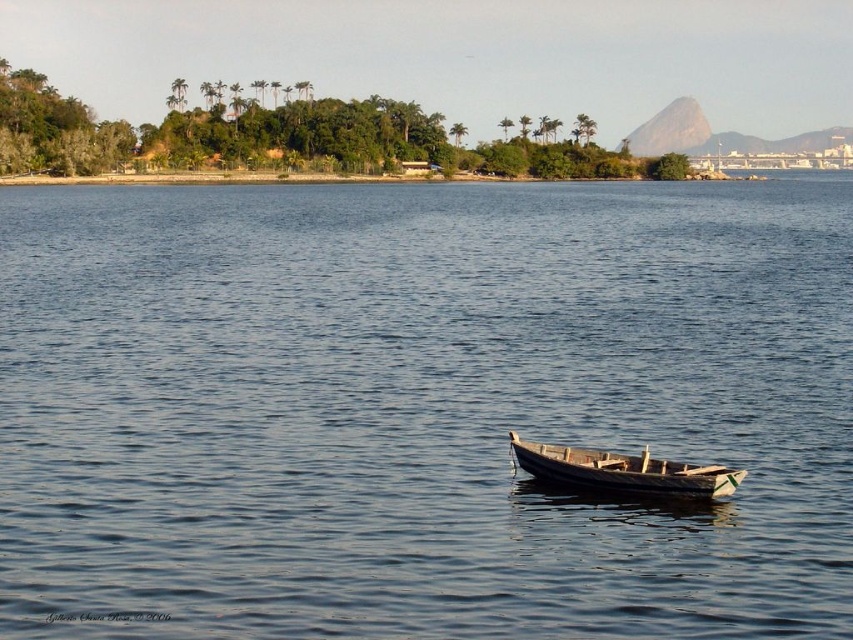
Based on the photo, you are standing on the shore looking at the blue water at center and the wooden boat at center. Which object is higher in the image?

The blue water at center is located above the wooden boat at center, so the blue water at center is higher in the image.

You are standing at the edge of the blue water at center and want to reach the wooden boat at center. Given that your maximum walking distance is 80 feet, can you reach the boat without swimming?

The blue water at center and wooden boat at center are 85.31 feet apart from each other. Since your maximum walking distance is 80 feet, you cannot reach the boat without swimming.

You are standing at the point labeled as point [421,408]. What is the color of the area you are currently standing on?

The area you are standing on is blue water at center, as indicated by the point [421,408].